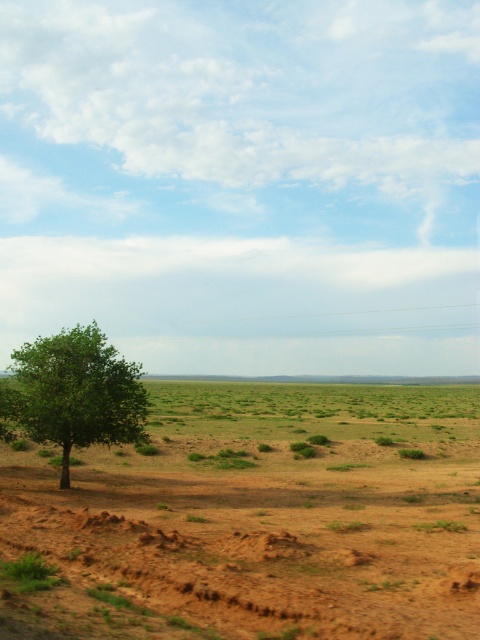
You are a hiker planning to set up a tent in the brown sandy dirt field at lower left. However, you notice the green leafy tree at left nearby. Should you be concerned about the tree potentially blocking sunlight to your tent area?

The brown sandy dirt field at lower left is positioned under the green leafy tree at left, meaning the tree is directly above the field. This would likely cast shade over the area, reducing sunlight reaching your tent. Consider choosing a spot further away from the tree if you want more sunlight.

You are standing at the point with coordinates point (x=82, y=419) and want to walk to the distant hills visible on the horizon. There is an obstacle at point (x=279, y=474). Will you be able to see the obstacle from your current position?

Point (x=279, y=474) is behind point (x=82, y=419), so you will not be able to see the obstacle at point (x=279, y=474) from your current position at point (x=82, y=419) because it is obscured by the foreground.